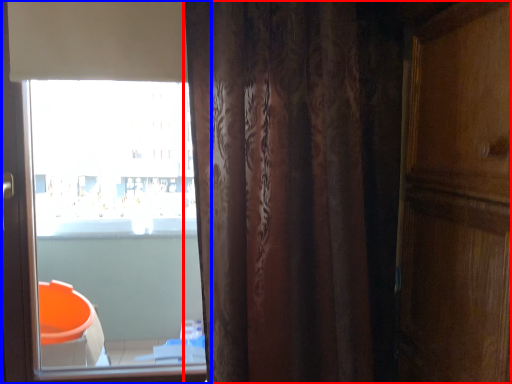
Question: Which of the following is the farthest to the observer, curtain (highlighted by a red box) or window (highlighted by a blue box)?

Choices:
 (A) curtain
 (B) window

Answer: (B)